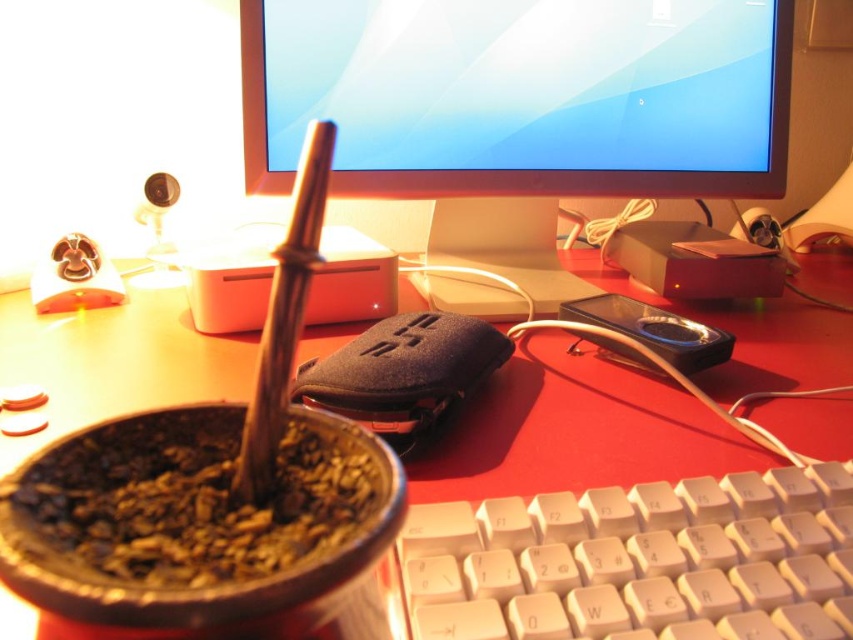
Does white plastic keyboard at lower center have a lesser height compared to matte black keyboard at lower center?

Indeed, white plastic keyboard at lower center has a lesser height compared to matte black keyboard at lower center.

Is white plastic keyboard at lower center to the right of matte black keyboard at lower center from the viewer's perspective?

No, white plastic keyboard at lower center is not to the right of matte black keyboard at lower center.

Does point (476, 541) come behind point (305, 340)?

No, it is in front of (305, 340).

Identify the location of white plastic keyboard at lower center. This screenshot has width=853, height=640. (639, 561).

Who is more forward, (785,422) or (155,528)?

Point (155,528) is more forward.

Which is behind, point (811, 259) or point (247, 525)?

Positioned behind is point (811, 259).

Between point (27, 353) and point (361, 502), which one is positioned behind?

Positioned behind is point (27, 353).

Locate an element on the screen. Image resolution: width=853 pixels, height=640 pixels. matte black keyboard at lower center is located at coordinates (582, 429).

Is point (519, 45) in front of point (183, 358)?

No, it is behind (183, 358).

Can you confirm if matte black monitor at upper center is positioned to the right of matte black keyboard at lower center?

No, matte black monitor at upper center is not to the right of matte black keyboard at lower center.

At what (x,y) coordinates should I click in order to perform the action: click on matte black monitor at upper center. Please return your answer as a coordinate pair (x, y). Image resolution: width=853 pixels, height=640 pixels. Looking at the image, I should click on (521, 96).